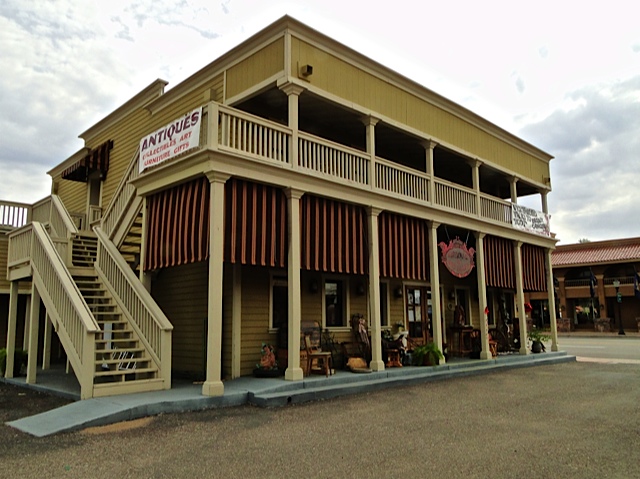
Image resolution: width=640 pixels, height=479 pixels. What are the coordinates of `curtain` in the screenshot? It's located at (159, 213), (242, 246), (330, 249), (416, 247), (502, 252), (538, 267).